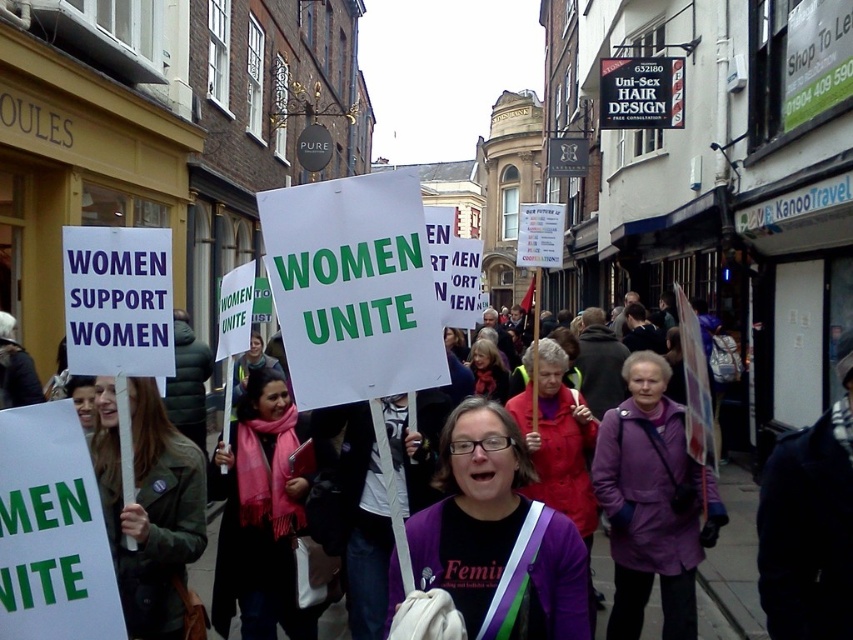
Between point (613, 518) and point (479, 364), which one is positioned in front?

Positioned in front is point (613, 518).

Is purple fabric coat at center behind matte pink scarf at center?

No, purple fabric coat at center is in front of matte pink scarf at center.

Between point (666, 560) and point (473, 376), which one is positioned in front?

Point (666, 560) is more forward.

Identify the location of purple fabric coat at center. (653, 502).

Can you confirm if purple fabric at center is shorter than purple fabric coat at center?

Correct, purple fabric at center is not as tall as purple fabric coat at center.

Which is behind, point (538, 600) or point (670, 577)?

The point (670, 577) is more distant.

Locate an element on the screen. Image resolution: width=853 pixels, height=640 pixels. purple fabric at center is located at coordinates (498, 536).

Which is more to the right, matte red coat at center or matte pink scarf at center?

matte red coat at center

Can you confirm if matte red coat at center is positioned to the left of matte pink scarf at center?

Incorrect, matte red coat at center is not on the left side of matte pink scarf at center.

Is point (535, 404) behind point (474, 349)?

No.

Identify the location of matte red coat at center. Image resolution: width=853 pixels, height=640 pixels. (556, 436).